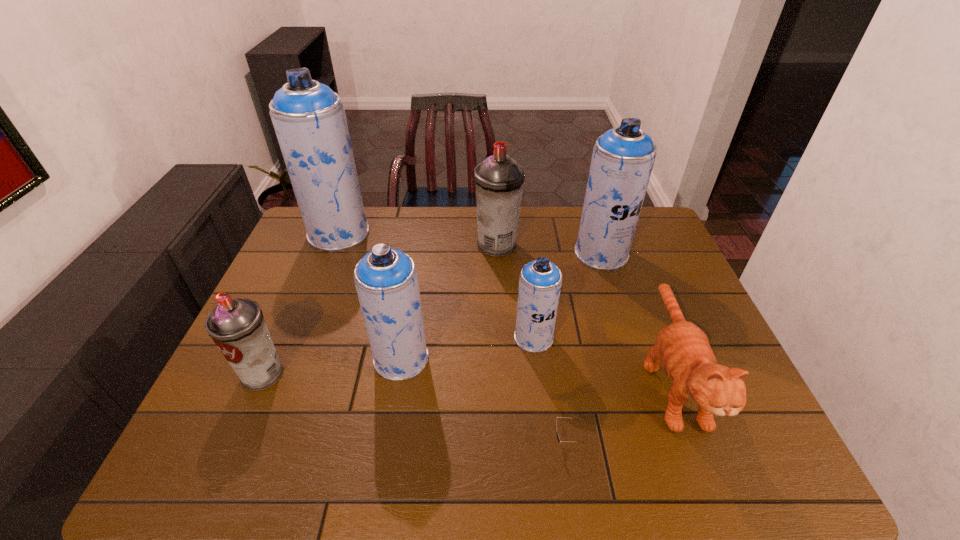
You are a GUI agent. You are given a task and a screenshot of the screen. Output one action in this format:
    pyautogui.click(x=<x>, y=<y>)
    Task: Click on the leftmost blue aerosol can
    This screenshot has height=540, width=960.
    Given the screenshot: What is the action you would take?
    pyautogui.click(x=309, y=119)

Find the location of a particular element. The height and width of the screenshot is (540, 960). the biggest blue aerosol can is located at coordinates (309, 119).

In order to click on the second biggest blue aerosol can in this screenshot , I will do `click(623, 157)`.

Find the location of a particular element. the rightmost aerosol can is located at coordinates (623, 157).

This screenshot has height=540, width=960. Find the location of `the right gray aerosol can`. the right gray aerosol can is located at coordinates (499, 180).

You are a GUI agent. You are given a task and a screenshot of the screen. Output one action in this format:
    pyautogui.click(x=<x>, y=<y>)
    Task: Click on the bigger gray aerosol can
    
    Given the screenshot: What is the action you would take?
    pyautogui.click(x=499, y=180)

The image size is (960, 540). I want to click on the sixth object from right to left, so click(386, 279).

Where is `the third blue aerosol can from right to left`? The height and width of the screenshot is (540, 960). the third blue aerosol can from right to left is located at coordinates (386, 279).

You are a GUI agent. You are given a task and a screenshot of the screen. Output one action in this format:
    pyautogui.click(x=<x>, y=<y>)
    Task: Click on the third blue aerosol can from left to right
    This screenshot has width=960, height=540.
    Given the screenshot: What is the action you would take?
    pyautogui.click(x=540, y=280)

Image resolution: width=960 pixels, height=540 pixels. Find the location of `the smaller gray aerosol can`. the smaller gray aerosol can is located at coordinates (237, 326).